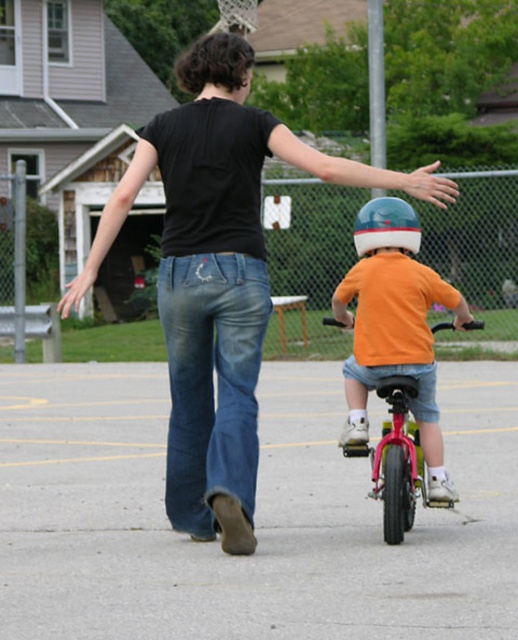
Who is more forward, (438, 445) or (416, 385)?

Point (416, 385) is more forward.

At what (x,y) coordinates should I click in order to perform the action: click on orange matte shirt at center. Please return your answer as a coordinate pair (x, y). The width and height of the screenshot is (518, 640). Looking at the image, I should click on (395, 326).

Between point (398, 442) and point (249, 17), which one is positioned in front?

Point (398, 442) is in front.

Could you measure the distance between metallic pink bicycle at center and brushed metal basketball hoop at upper center?

metallic pink bicycle at center is 29.46 meters away from brushed metal basketball hoop at upper center.

Which is in front, point (420, 452) or point (237, 16)?

Point (420, 452)

The image size is (518, 640). I want to click on metallic pink bicycle at center, so click(397, 460).

Is point (111, 204) positioned before point (406, 486)?

That is True.

From the picture: Between black matte shirt at upper center and metallic pink bicycle at center, which one is positioned higher?

black matte shirt at upper center

Where is `black matte shirt at upper center`? The height and width of the screenshot is (640, 518). black matte shirt at upper center is located at coordinates (219, 275).